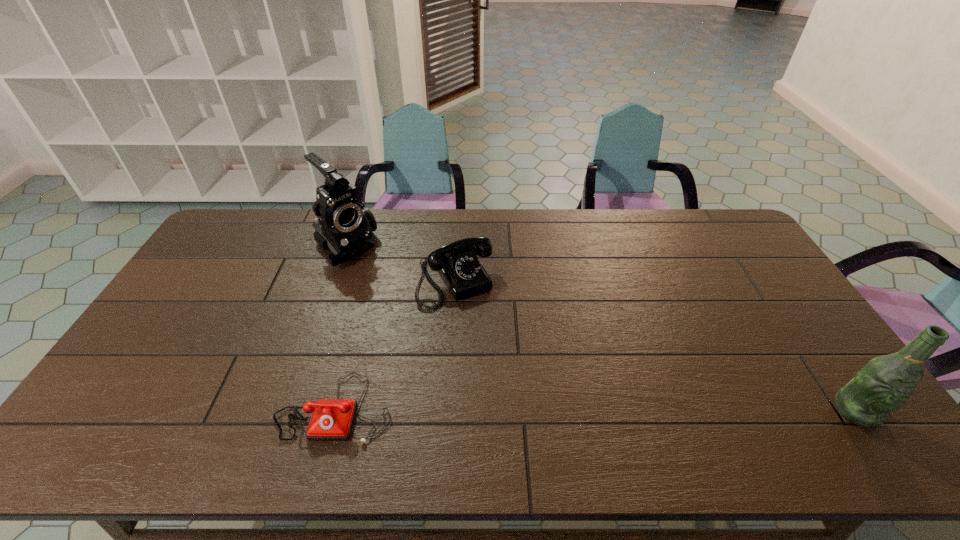
Locate an element on the screen. Image resolution: width=960 pixels, height=540 pixels. free space on the desktop that is between the left telephone and the rightmost object and is positioned on the dial of the farther telephone is located at coordinates (531, 408).

In order to click on vacant space on the desktop that is between the shorter telephone and the beer bottle and is positioned on the lens mount of the camcorder in this screenshot , I will do `click(525, 408)`.